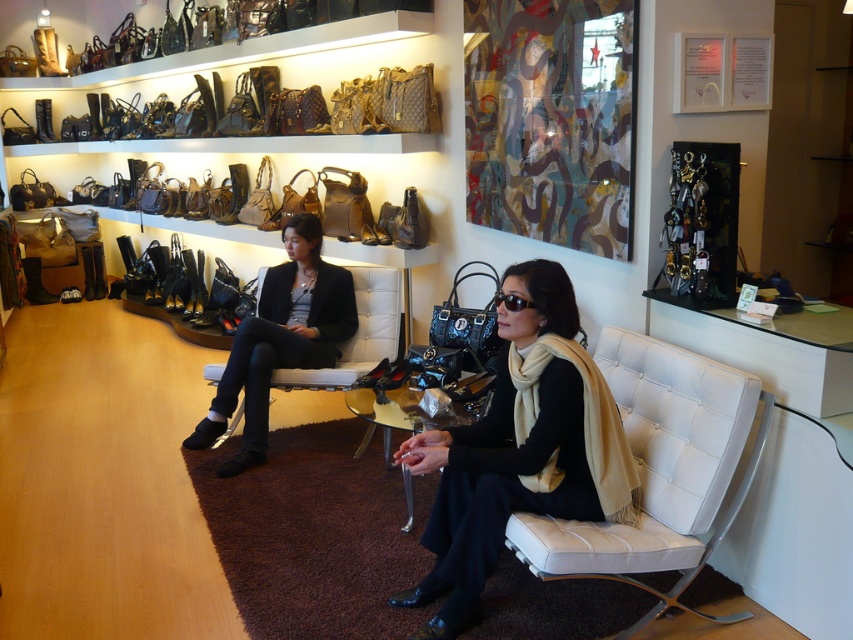
Is white leather chair at center smaller than black leather shoes at center?

No, white leather chair at center is not smaller than black leather shoes at center.

Does point (750, 474) come closer to viewer compared to point (352, 308)?

Yes, point (750, 474) is closer to viewer.

Between point (677, 404) and point (310, 244), which one is positioned in front?

Positioned in front is point (677, 404).

This screenshot has height=640, width=853. Find the location of `white leather chair at center`. white leather chair at center is located at coordinates pyautogui.click(x=659, y=472).

Which is more to the left, black leather scarf at center or white leather chair at center?

black leather scarf at center is more to the left.

Does point (582, 458) come behind point (608, 378)?

No, (582, 458) is in front of (608, 378).

Describe the element at coordinates (519, 449) in the screenshot. I see `black leather scarf at center` at that location.

Where is `black leather scarf at center`? The width and height of the screenshot is (853, 640). black leather scarf at center is located at coordinates pyautogui.click(x=519, y=449).

Between black leather scarf at center and black leather shoes at center, which one is positioned lower?

black leather scarf at center

Measure the distance between black leather scarf at center and camera.

black leather scarf at center is 6.70 feet from camera.

Identify the location of black leather scarf at center. (519, 449).